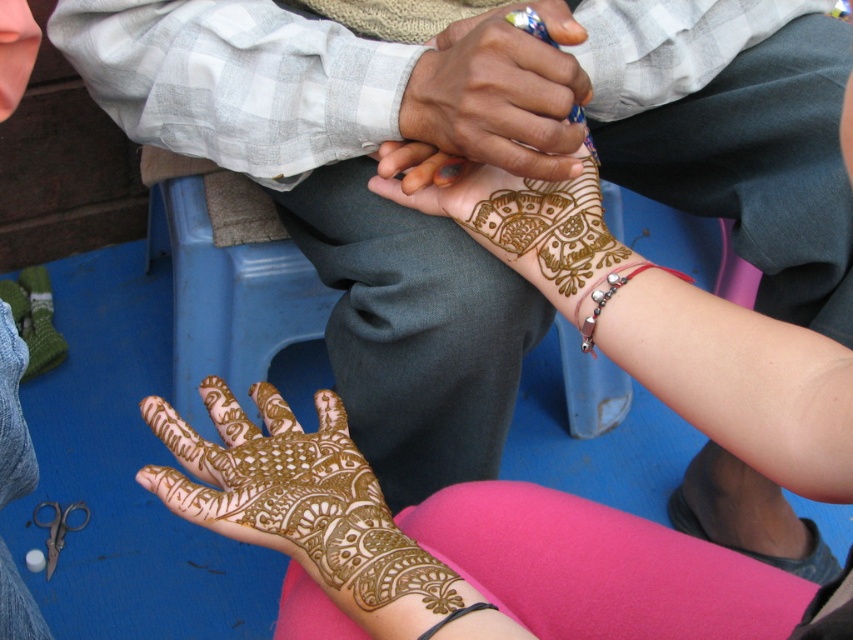
What are the coordinates of the brown henna tattoo at center?

The brown henna tattoo at center is located at point (300, 502).

You are standing in front of the image and want to reach the point at coordinates point (260, 520). If your arm can extend 50 centimeters, will you be able to touch it?

The point (260, 520) is 60.96 centimeters away from the camera, so your arm can only extend 50 centimeters, meaning you cannot reach it.

You are a photographer trying to focus on two points in the image. The first point is at coordinates point (335, 460) and the second is at point (585, 294). Which point is closer to your camera lens?

Point (335, 460) is further to the camera than point (585, 294), so the closer point to the camera lens is point (585, 294).